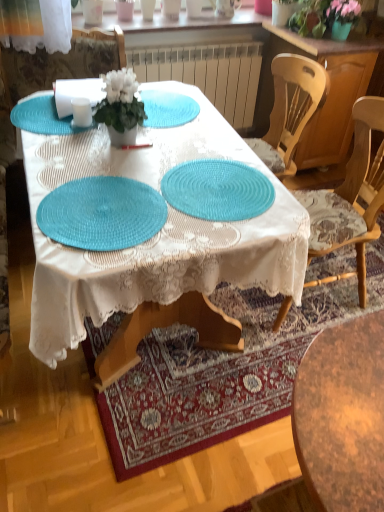
Find the location of a particular element. The width and height of the screenshot is (384, 512). vacant area that lies between teal woven placemat at center, the 1th glass plate ordered from the bottom, and teal woven placemat at center, the second glass plate positioned from the bottom is located at coordinates (162, 195).